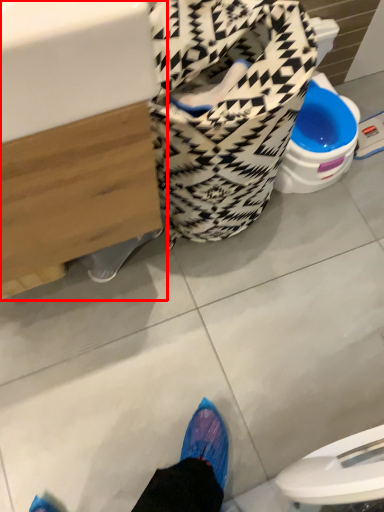
Question: Considering the relative positions of sink (annotated by the red box) and laundry basket in the image provided, where is sink (annotated by the red box) located with respect to the staircase?

Choices:
 (A) left
 (B) right

Answer: (A)